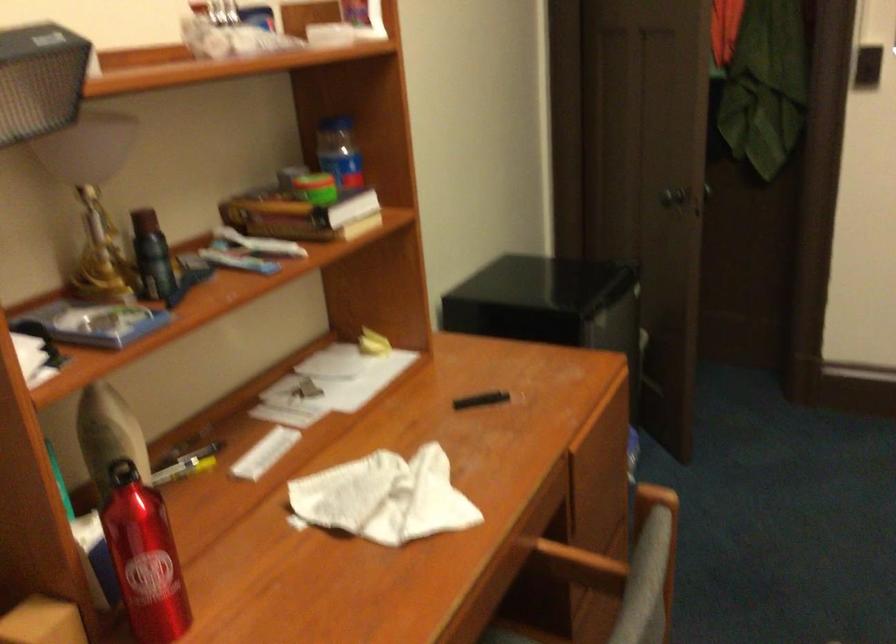
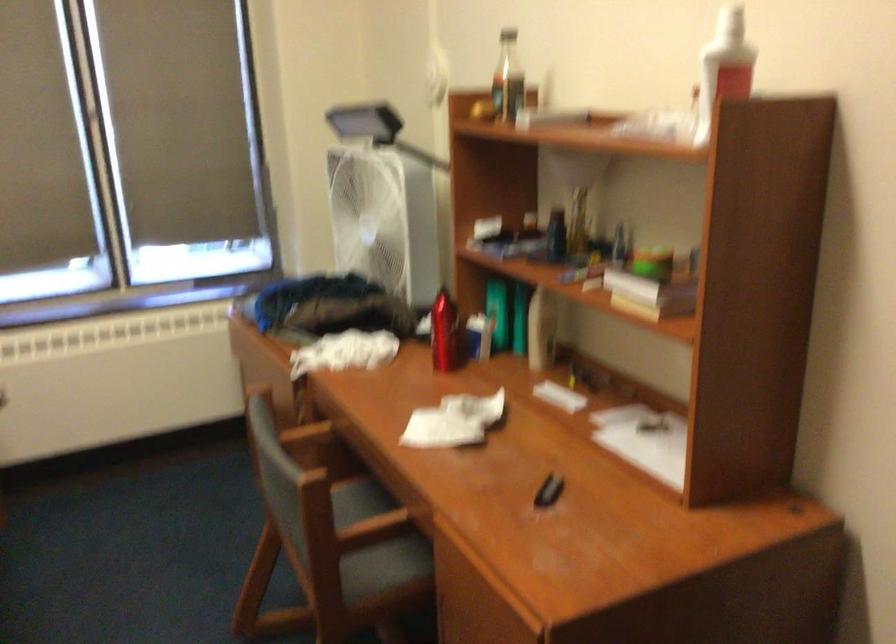
Where in the second image is the point corresponding to [175,540] from the first image?

(444, 333)